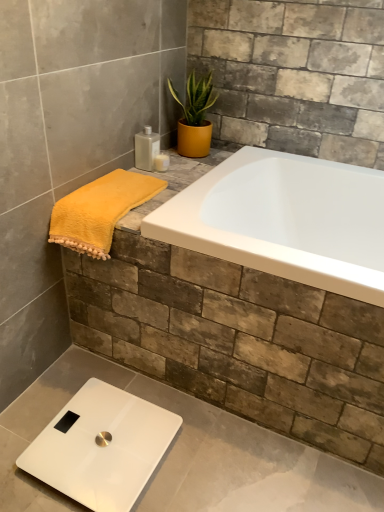
Locate an element on the screen. This screenshot has width=384, height=512. free space in front of matte yellow pot at upper center is located at coordinates (186, 168).